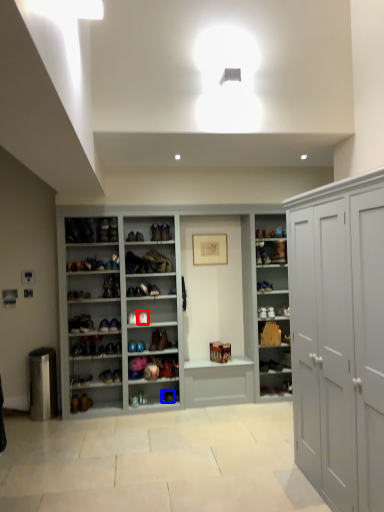
Question: Which object appears farthest to the camera in this image, shoe (highlighted by a red box) or shoe (highlighted by a blue box)?

Choices:
 (A) shoe
 (B) shoe

Answer: (B)